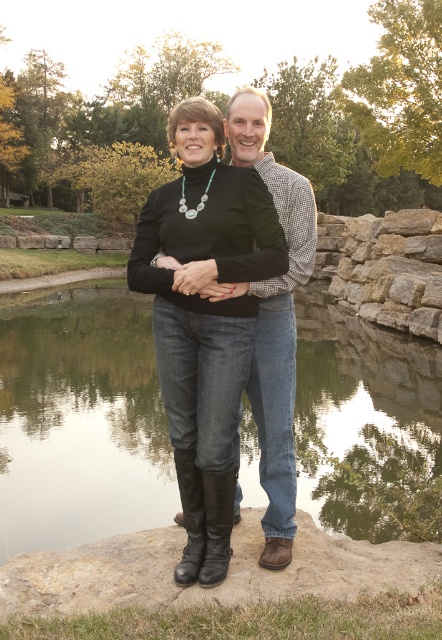
Does transparent glass water at center appear over black leather boots at center?

No.

Between transparent glass water at center and black leather boots at center, which one appears on the left side from the viewer's perspective?

black leather boots at center is more to the left.

Which is in front, point (60, 477) or point (240, 260)?

Point (240, 260) is in front.

Locate an element on the screen. This screenshot has height=640, width=442. transparent glass water at center is located at coordinates (80, 419).